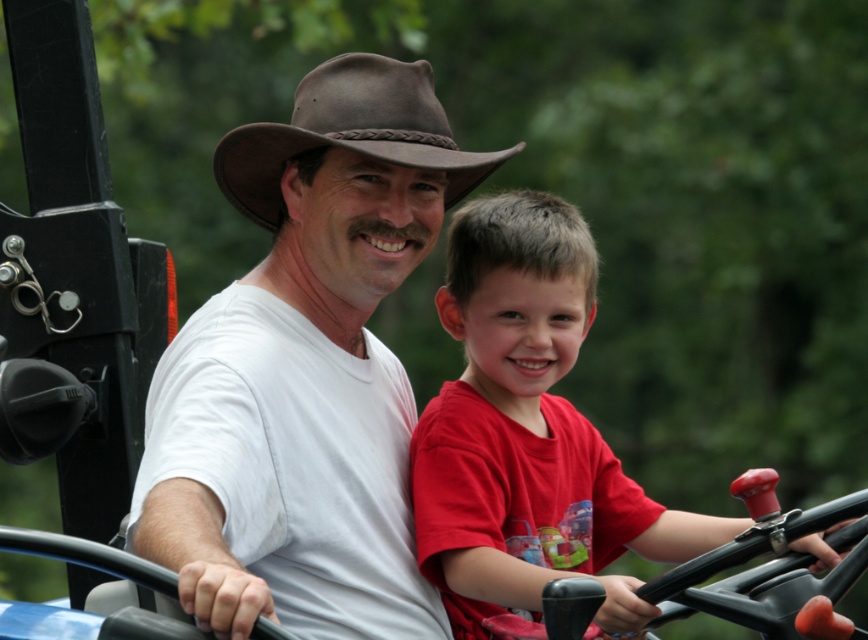
Can you confirm if red matte shirt at center is bigger than brown leather fedora at center?

Yes, red matte shirt at center is bigger than brown leather fedora at center.

Which of these two, red matte shirt at center or brown leather fedora at center, stands shorter?

brown leather fedora at center is shorter.

Is point (510, 513) positioned in front of point (366, 106)?

That is False.

You are a GUI agent. You are given a task and a screenshot of the screen. Output one action in this format:
    pyautogui.click(x=<x>, y=<y>)
    Task: Click on the red matte shirt at center
    The height and width of the screenshot is (640, 868).
    Given the screenshot: What is the action you would take?
    pyautogui.click(x=525, y=426)

Can you confirm if white matte shirt at center is smaller than red matte shirt at center?

Actually, white matte shirt at center might be larger than red matte shirt at center.

Is point (158, 532) behind point (513, 468)?

No.

Which is behind, point (185, 477) or point (523, 333)?

The point (523, 333) is behind.

I want to click on white matte shirt at center, so click(x=306, y=371).

Who is taller, white matte shirt at center or brown leather fedora at center?

white matte shirt at center is taller.

Between point (380, 634) and point (431, 134), which one is positioned in front?

Point (380, 634) is more forward.

At what (x,y) coordinates should I click in order to perform the action: click on white matte shirt at center. Please return your answer as a coordinate pair (x, y). This screenshot has width=868, height=640. Looking at the image, I should click on (306, 371).